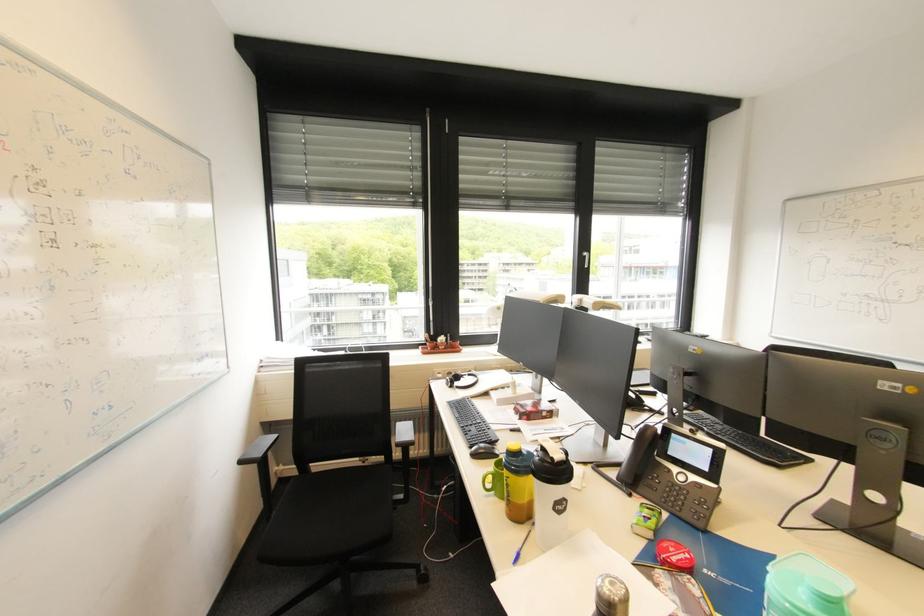
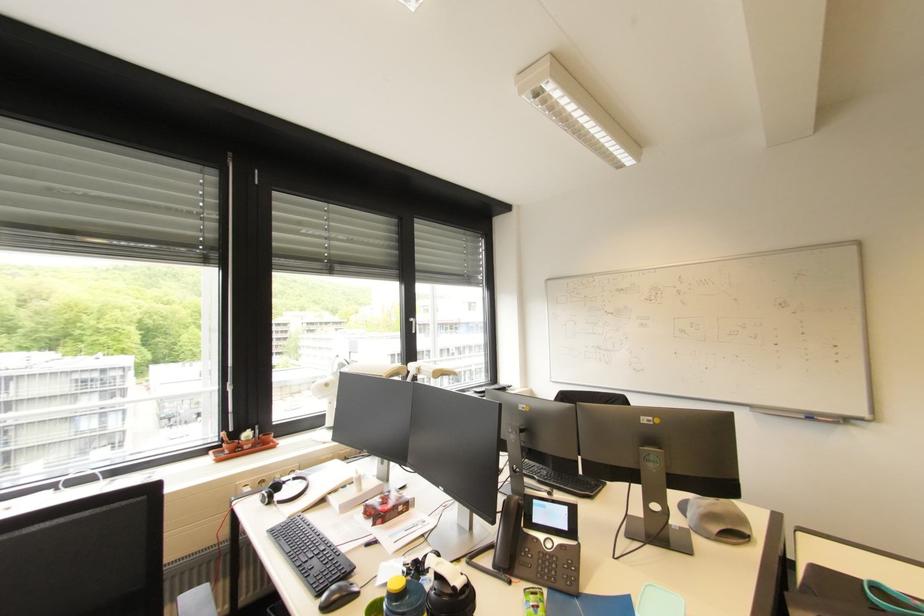
Where in the second image is the point corresponding to point 715,451 from the first image?

(572, 509)